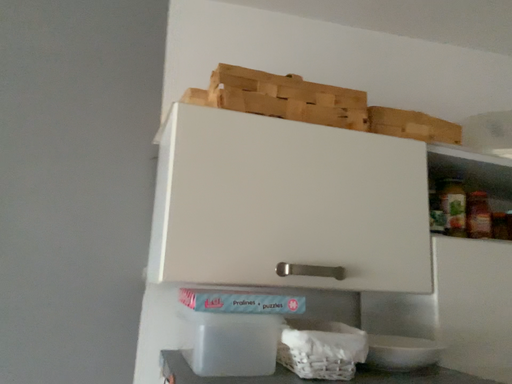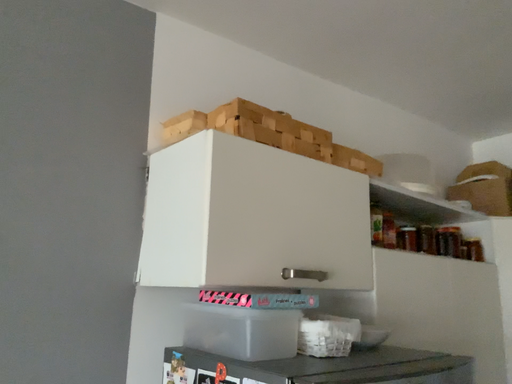
Question: How did the camera likely rotate when shooting the video?

Choices:
 (A) rotated left
 (B) rotated right

Answer: (B)